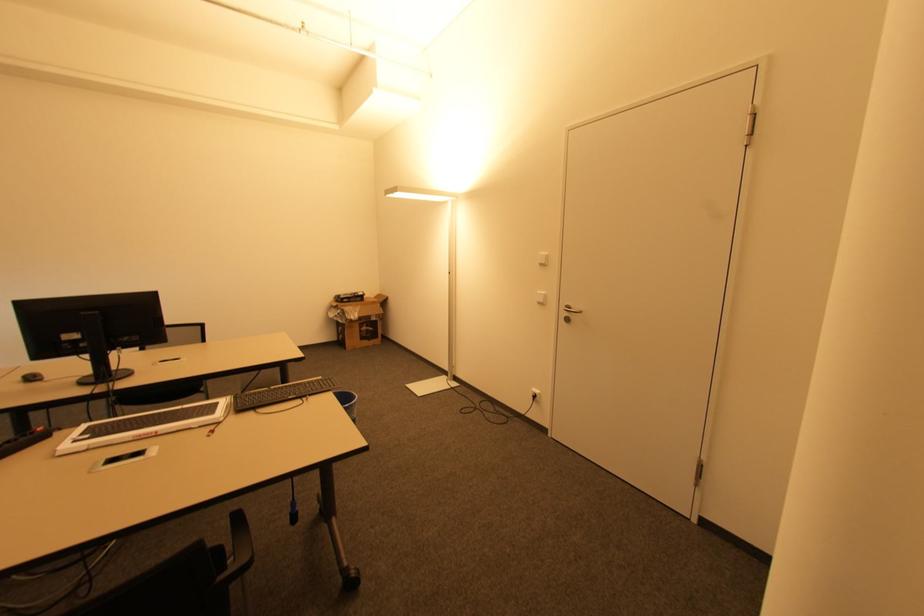
Find where to push the black wall plug. Please return your answer as a coordinate pair (x, y).

(535, 395)